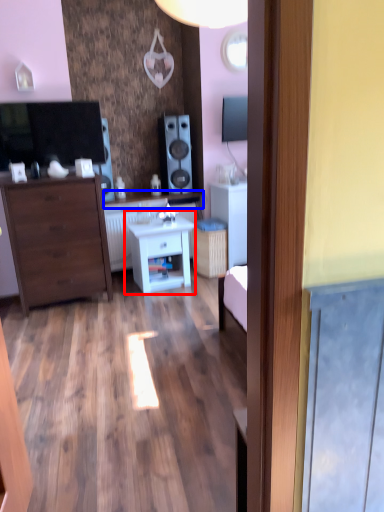
Question: Which object appears farthest to the camera in this image, nightstand (highlighted by a red box) or counter top (highlighted by a blue box)?

Choices:
 (A) nightstand
 (B) counter top

Answer: (B)